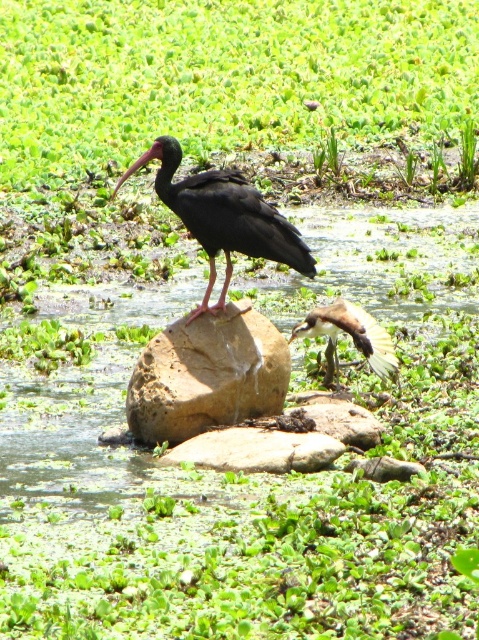
Question: Which object is closer to the camera taking this photo?

Choices:
 (A) clear water at rock center
 (B) brown feathered bird at center
 (C) brown rough rock at center

Answer: (A)

Question: Is brown rough rock at center wider than brown feathered bird at center?

Choices:
 (A) yes
 (B) no

Answer: (A)

Question: Can you confirm if brown rough rock at center is positioned to the left of brown feathered bird at center?

Choices:
 (A) no
 (B) yes

Answer: (B)

Question: Which of the following is the farthest from the observer?

Choices:
 (A) clear water at rock center
 (B) brown feathered bird at center

Answer: (B)

Question: Does clear water at rock center appear over brown rough rock at center?

Choices:
 (A) no
 (B) yes

Answer: (A)

Question: Which point is farther to the camera?

Choices:
 (A) (232, 378)
 (B) (135, 168)
 (C) (355, 307)
 (D) (107, 291)

Answer: (D)